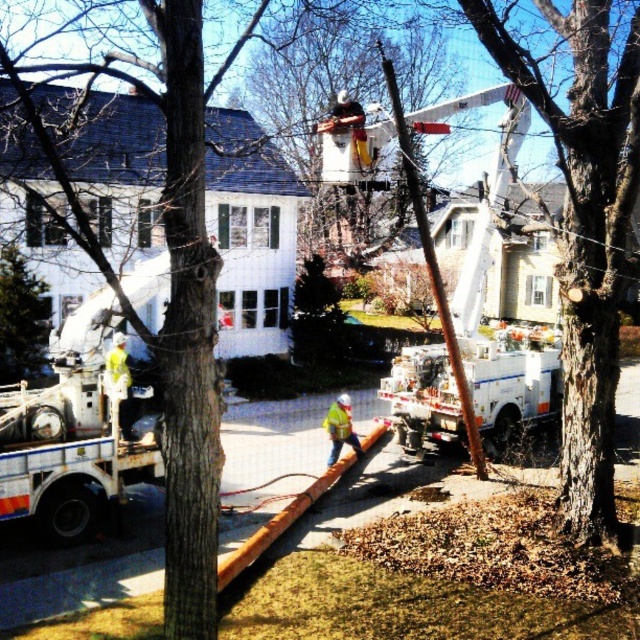
From the picture: You are a pedestrian standing on the sidewalk and see the white metallic utility truck at left and the yellow reflective safety vest at center. Which object is located to the left of the other?

The white metallic utility truck at left is positioned on the left side of yellow reflective safety vest at center.

You are a pedestrian crossing the street and notice the white metallic utility truck at left and the yellow reflective safety vest at center. Which object is bigger in size?

The white metallic utility truck at left is larger in size compared to the yellow reflective safety vest at center.

You are a pedestrian walking on the sidewalk and see the white metallic utility truck at left and the yellow reflective safety vest at center. Which object is closer to the sidewalk?

The yellow reflective safety vest at center is closer to the sidewalk because the white metallic utility truck at left is positioned over it.